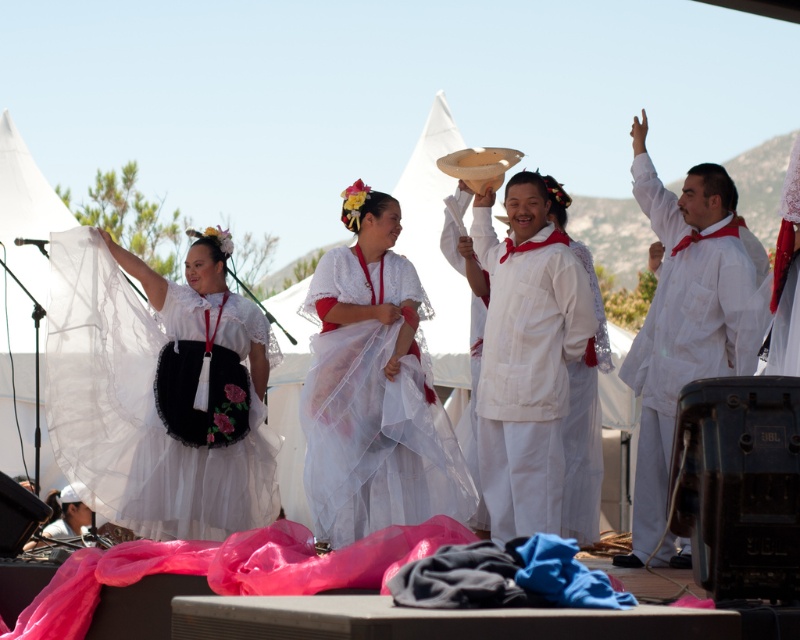
Question: Which point is farther to the camera?

Choices:
 (A) white sheer dress at center
 (B) white sheer skirt at left
 (C) white cotton dress at center

Answer: (C)

Question: Can you confirm if white cotton dress at center is smaller than white sheer robe at right?

Choices:
 (A) no
 (B) yes

Answer: (B)

Question: Does white sheer skirt at left appear on the right side of white sheer robe at right?

Choices:
 (A) yes
 (B) no

Answer: (B)

Question: Does white sheer skirt at left appear on the left side of white sheer dress at center?

Choices:
 (A) no
 (B) yes

Answer: (B)

Question: Which object is farther from the camera taking this photo?

Choices:
 (A) white sheer skirt at left
 (B) white cotton dress at center
 (C) white sheer robe at right

Answer: (B)

Question: Which is nearer to the white cotton dress at center?

Choices:
 (A) white sheer skirt at left
 (B) white sheer robe at right
 (C) white sheer dress at center

Answer: (C)